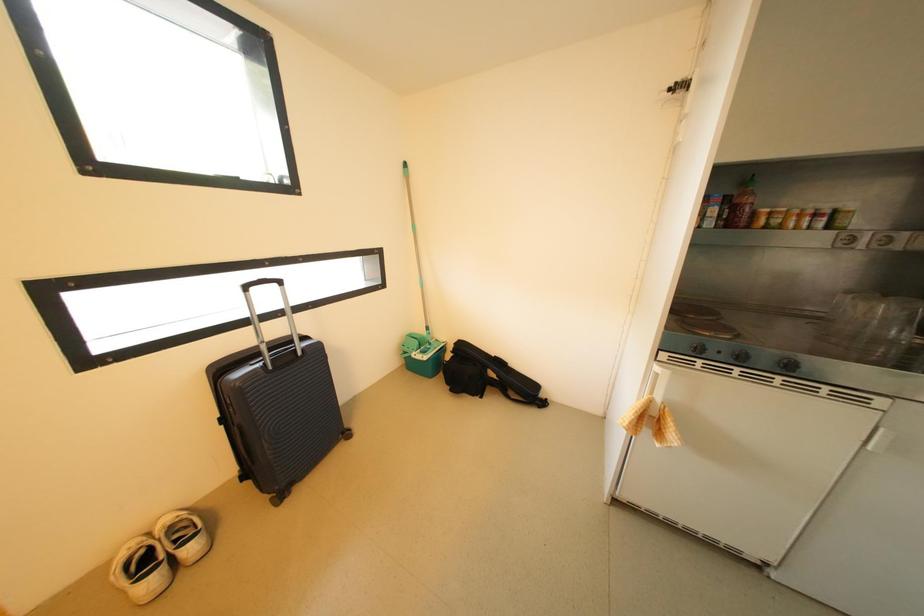
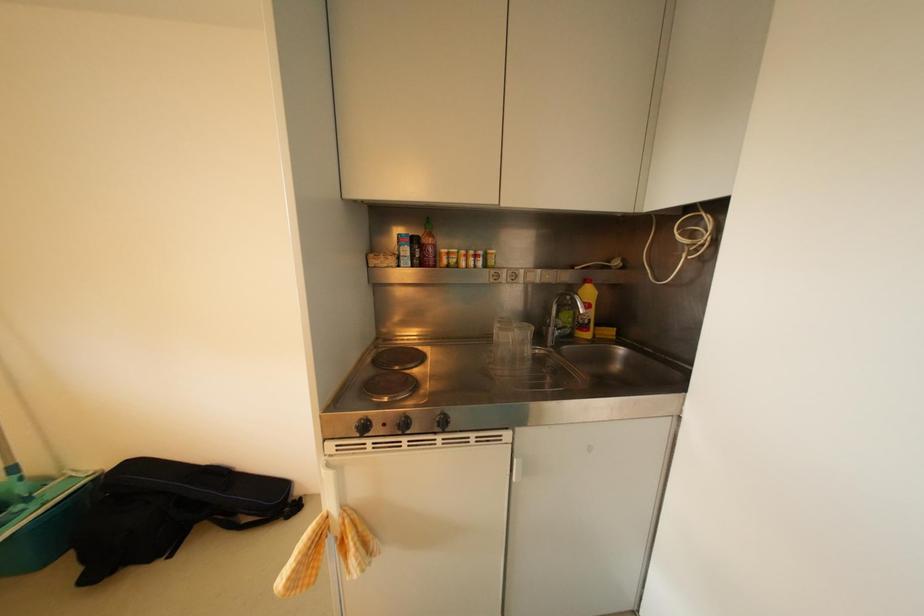
Question: The first image is from the beginning of the video and the second image is from the end. How did the camera likely rotate when shooting the video?

Choices:
 (A) Left
 (B) Right
 (C) Up
 (D) Down

Answer: (B)